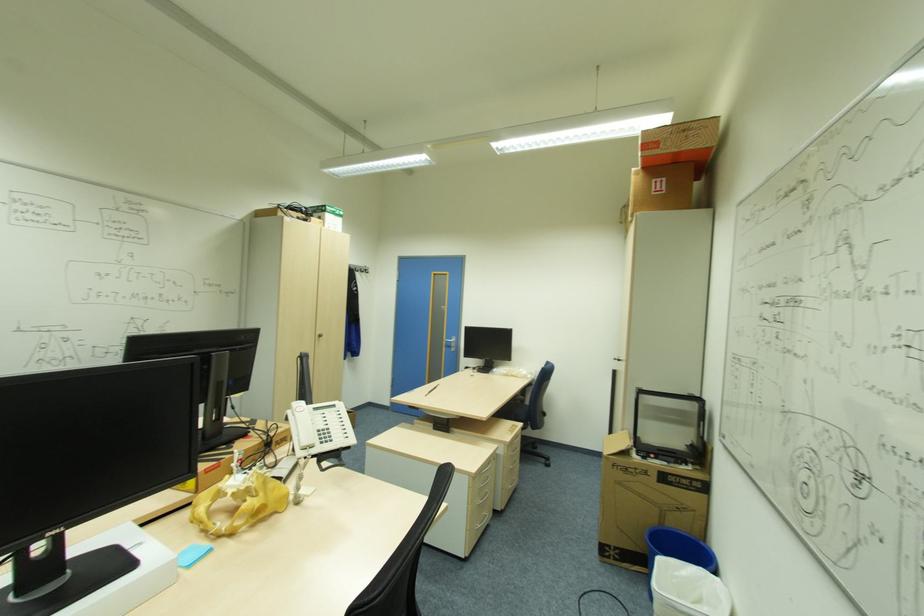
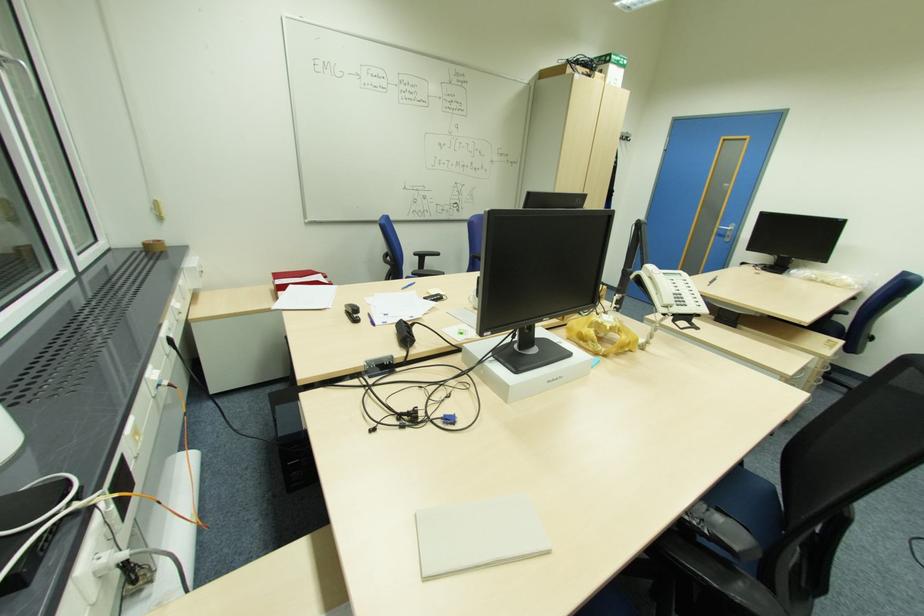
Locate, in the second image, the point that corresponds to (309,448) in the first image.

(670, 306)